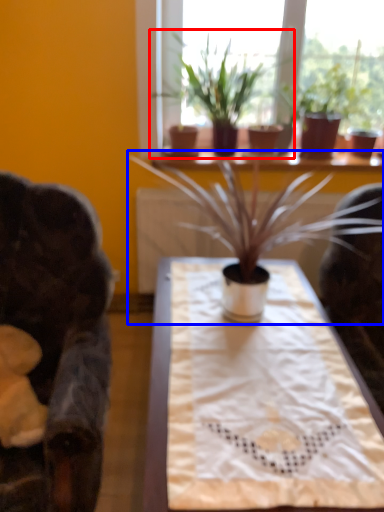
Question: Which object appears farthest to the camera in this image, houseplant (highlighted by a red box) or houseplant (highlighted by a blue box)?

Choices:
 (A) houseplant
 (B) houseplant

Answer: (A)